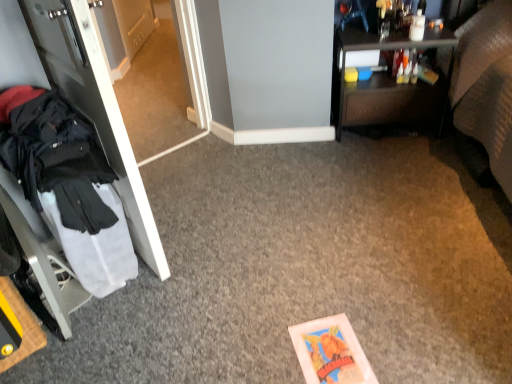
Question: Is transparent glass door at left thinner than dark brown wood desk at upper right?

Choices:
 (A) yes
 (B) no

Answer: (A)

Question: Is transparent glass door at left to the right of dark brown wood desk at upper right from the viewer's perspective?

Choices:
 (A) yes
 (B) no

Answer: (B)

Question: Is transparent glass door at left not near dark brown wood desk at upper right?

Choices:
 (A) no
 (B) yes

Answer: (B)

Question: Considering the relative sizes of transparent glass door at left and dark brown wood desk at upper right in the image provided, is transparent glass door at left taller than dark brown wood desk at upper right?

Choices:
 (A) yes
 (B) no

Answer: (A)

Question: From a real-world perspective, is transparent glass door at left located higher than dark brown wood desk at upper right?

Choices:
 (A) yes
 (B) no

Answer: (A)

Question: Considering their positions, is white glossy door at left located in front of or behind dark brown wood desk at upper right?

Choices:
 (A) front
 (B) behind

Answer: (A)

Question: From the image's perspective, relative to dark brown wood desk at upper right, is white glossy door at left above or below?

Choices:
 (A) below
 (B) above

Answer: (A)

Question: In terms of height, does white glossy door at left look taller or shorter compared to dark brown wood desk at upper right?

Choices:
 (A) tall
 (B) short

Answer: (A)

Question: Visually, is white glossy door at left positioned to the left or to the right of dark brown wood desk at upper right?

Choices:
 (A) right
 (B) left

Answer: (B)

Question: Is transparent glass door at left to the left or to the right of black fabric coat at left in the image?

Choices:
 (A) left
 (B) right

Answer: (B)

Question: Relative to black fabric coat at left, is transparent glass door at left in front or behind?

Choices:
 (A) behind
 (B) front

Answer: (A)

Question: In terms of height, does transparent glass door at left look taller or shorter compared to black fabric coat at left?

Choices:
 (A) tall
 (B) short

Answer: (A)

Question: Looking at the image, does transparent glass door at left seem bigger or smaller compared to black fabric coat at left?

Choices:
 (A) small
 (B) big

Answer: (B)

Question: In the image, is transparent glass door at left positioned in front of or behind white glossy door at left?

Choices:
 (A) front
 (B) behind

Answer: (B)

Question: Which is correct: transparent glass door at left is inside white glossy door at left, or outside of it?

Choices:
 (A) inside
 (B) outside

Answer: (B)